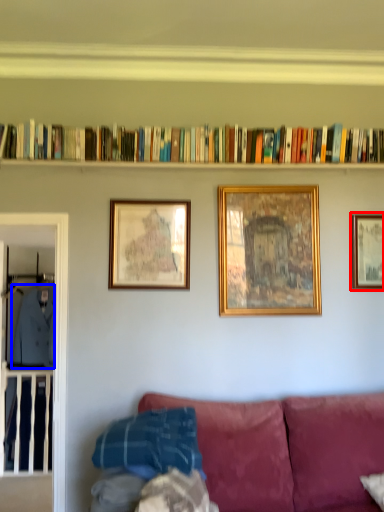
Question: Among these objects, which one is farthest to the camera, picture frame (highlighted by a red box) or clothing (highlighted by a blue box)?

Choices:
 (A) picture frame
 (B) clothing

Answer: (B)